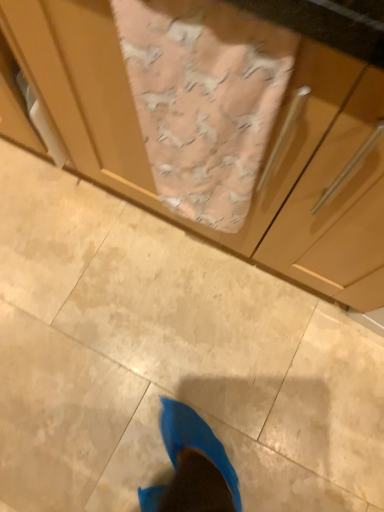
The width and height of the screenshot is (384, 512). Describe the element at coordinates (265, 152) in the screenshot. I see `matte wood cabinet at center` at that location.

Identify the location of matte wood cabinet at center. (265, 152).

At what (x,y) coordinates should I click in order to perform the action: click on pink fabric at center. Please return your answer as a coordinate pair (x, y). The image size is (384, 512). Looking at the image, I should click on (204, 99).

Describe the element at coordinates (204, 99) in the screenshot. Image resolution: width=384 pixels, height=512 pixels. I see `pink fabric at center` at that location.

Where is `matte wood cabinet at center`? Image resolution: width=384 pixels, height=512 pixels. matte wood cabinet at center is located at coordinates (265, 152).

Is matte wood cabinet at center at the right side of pink fabric at center?

Incorrect, matte wood cabinet at center is not on the right side of pink fabric at center.

Is matte wood cabinet at center further to the viewer compared to pink fabric at center?

No, matte wood cabinet at center is closer to the viewer.

Is point (155, 203) farther from camera compared to point (198, 32)?

Yes, point (155, 203) is farther from viewer.

From the image's perspective, is matte wood cabinet at center located beneath pink fabric at center?

No, from the image's perspective, matte wood cabinet at center is not beneath pink fabric at center.

From a real-world perspective, is matte wood cabinet at center positioned under pink fabric at center based on gravity?

Yes, from a real-world perspective, matte wood cabinet at center is below pink fabric at center.

Between matte wood cabinet at center and pink fabric at center, which one has smaller width?

pink fabric at center is thinner.

Looking at this image, is matte wood cabinet at center shorter than pink fabric at center?

No.

Based on their sizes in the image, would you say matte wood cabinet at center is bigger or smaller than pink fabric at center?

Clearly, matte wood cabinet at center is larger in size than pink fabric at center.

Is matte wood cabinet at center inside the boundaries of pink fabric at center, or outside?

matte wood cabinet at center is spatially situated outside pink fabric at center.

Is matte wood cabinet at center next to pink fabric at center?

There is a gap between matte wood cabinet at center and pink fabric at center.

Is matte wood cabinet at center oriented towards pink fabric at center?

Yes, matte wood cabinet at center is turned towards pink fabric at center.

What's the angular difference between matte wood cabinet at center and pink fabric at center's facing directions?

The angle between the facing direction of matte wood cabinet at center and the facing direction of pink fabric at center is 0.000287 degrees.

Identify the location of blanket located below the matte wood cabinet at center (from the image's perspective). Image resolution: width=384 pixels, height=512 pixels. (204, 99).

Between pink fabric at center and matte wood cabinet at center, which one appears on the left side from the viewer's perspective?

From the viewer's perspective, matte wood cabinet at center appears more on the left side.

Which object is further away from the camera taking this photo, pink fabric at center or matte wood cabinet at center?

pink fabric at center is behind.

Is point (152, 101) closer or farther from the camera than point (64, 1)?

Point (152, 101) is farther from the camera than point (64, 1).

From the image's perspective, which object appears higher, pink fabric at center or matte wood cabinet at center?

matte wood cabinet at center appears higher in the image.

From a real-world perspective, who is located higher, pink fabric at center or matte wood cabinet at center?

pink fabric at center, from a real-world perspective.

Does pink fabric at center have a greater width compared to matte wood cabinet at center?

No, pink fabric at center is not wider than matte wood cabinet at center.

From their relative heights in the image, would you say pink fabric at center is taller or shorter than matte wood cabinet at center?

pink fabric at center is shorter than matte wood cabinet at center.

Considering the sizes of objects pink fabric at center and matte wood cabinet at center in the image provided, who is bigger, pink fabric at center or matte wood cabinet at center?

With larger size is matte wood cabinet at center.

Is pink fabric at center located outside matte wood cabinet at center?

No, pink fabric at center is not entirely external to matte wood cabinet at center.

Is pink fabric at center far away from matte wood cabinet at center?

No, pink fabric at center is not far away from matte wood cabinet at center.

Could you tell me if pink fabric at center is turned towards matte wood cabinet at center?

Yes, pink fabric at center faces towards matte wood cabinet at center.

Based on the photo, can you tell me how much pink fabric at center and matte wood cabinet at center differ in facing direction?

The angle between the facing direction of pink fabric at center and the facing direction of matte wood cabinet at center is 0.000287 degrees.

Locate an element on the screen. The height and width of the screenshot is (512, 384). cabinetry in front of the pink fabric at center is located at coordinates (265, 152).

The height and width of the screenshot is (512, 384). Find the location of `blanket located behind the matte wood cabinet at center`. blanket located behind the matte wood cabinet at center is located at coordinates (204, 99).

Locate an element on the screen. The width and height of the screenshot is (384, 512). cabinetry on the left of the pink fabric at center is located at coordinates (265, 152).